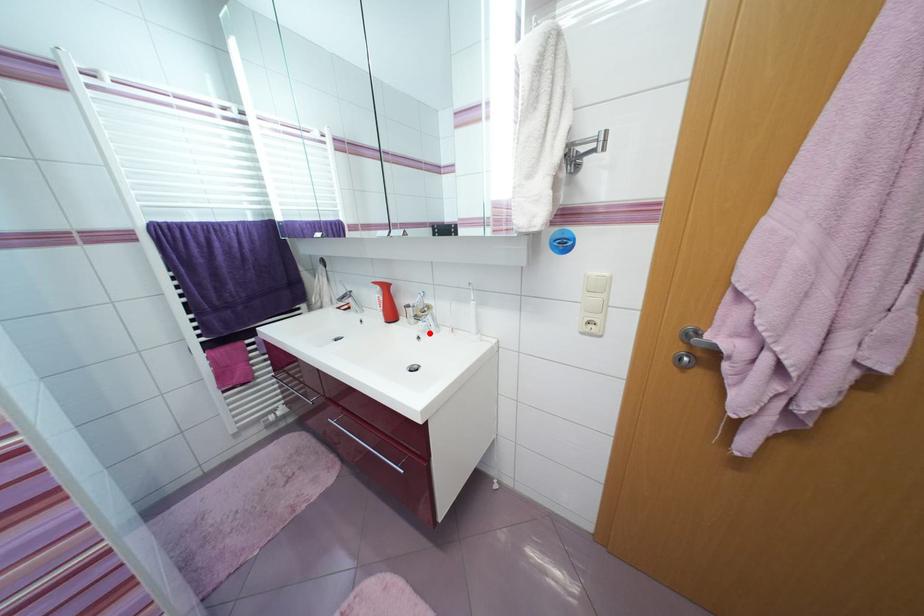
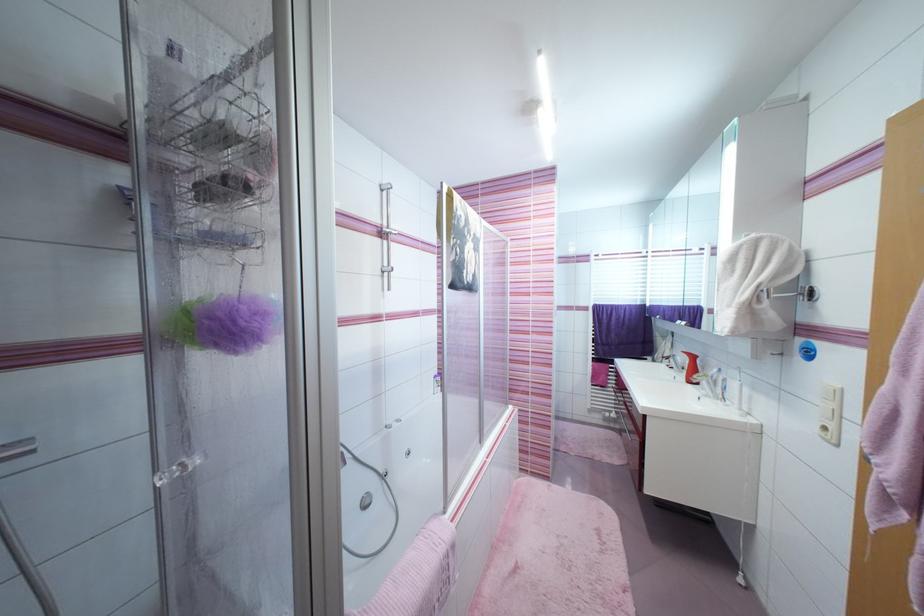
Question: I am providing you with two images of the same scene from different viewpoints. A red point is marked on the first image. Can you still see the location of the red point in image 2?

Choices:
 (A) Yes
 (B) No

Answer: (A)